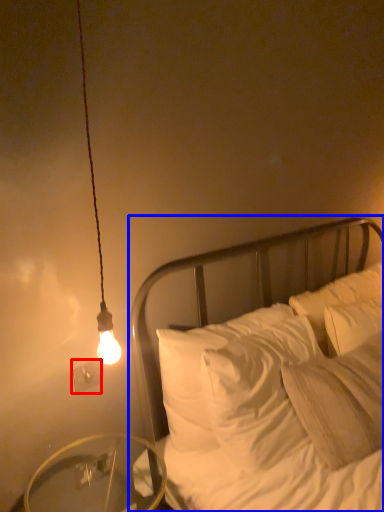
Question: Among these objects, which one is farthest to the camera, electric outlet (highlighted by a red box) or bed (highlighted by a blue box)?

Choices:
 (A) electric outlet
 (B) bed

Answer: (A)